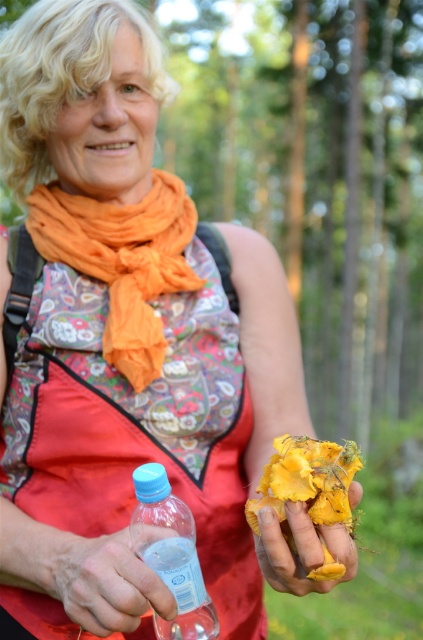
You are a photographer trying to capture the silky floral dress at center and the translucent plastic bottle at lower left in a single frame. Based on their positions, which object should you focus on first to ensure both are in focus?

The silky floral dress at center is located above the translucent plastic bottle at lower left, so focusing on the silky floral dress at center first will help ensure both are in focus as it is closer to the camera.